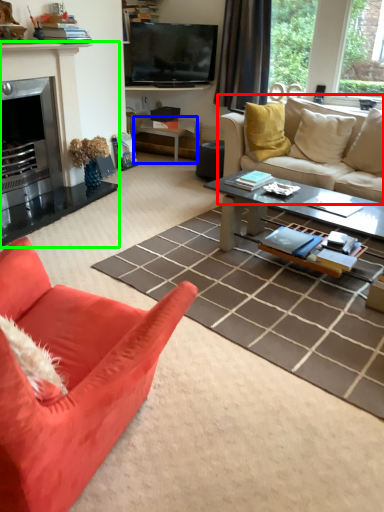
Question: Based on their relative distances, which object is nearer to studio couch (highlighted by a red box)? Choose from side table (highlighted by a blue box) and fireplace (highlighted by a green box).

Choices:
 (A) side table
 (B) fireplace

Answer: (A)